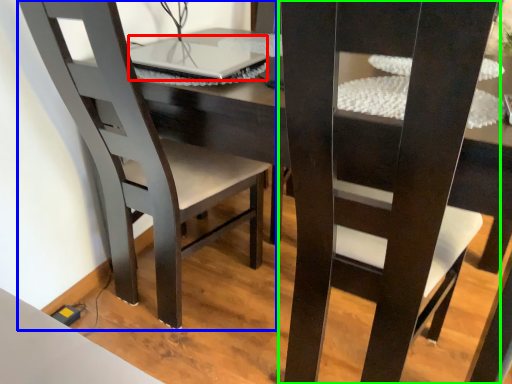
Question: Based on their relative distances, which object is nearer to laptop (highlighted by a red box)? Choose from chair (highlighted by a blue box) and chair (highlighted by a green box).

Choices:
 (A) chair
 (B) chair

Answer: (A)